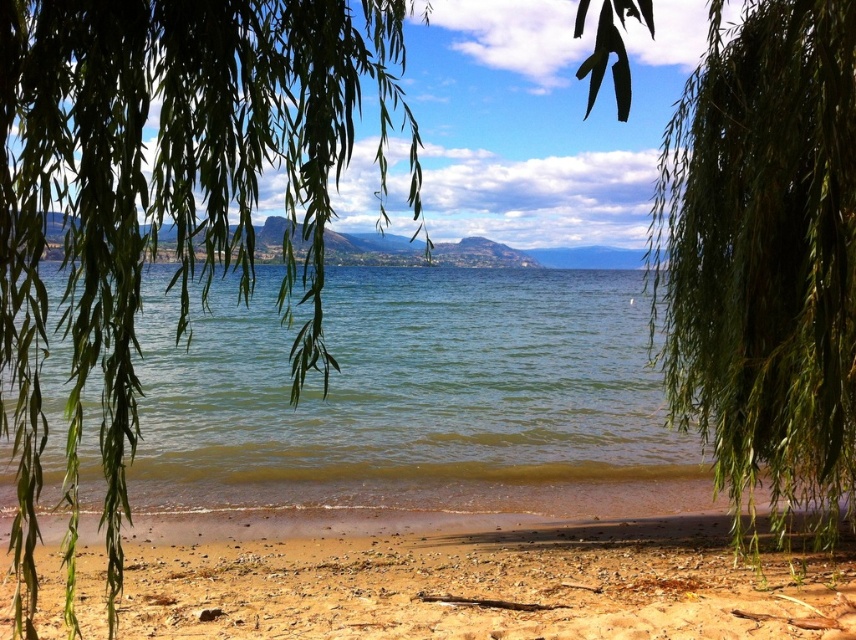
Question: Based on their relative distances, which object is farther from the brown sandy beach at lower center?

Choices:
 (A) green leafy branch at center
 (B) green leafy tree at center

Answer: (B)

Question: Is green leafy tree at center in front of green leafy branch at center?

Choices:
 (A) no
 (B) yes

Answer: (B)

Question: Which object is positioned closest to the green leafy branch at center?

Choices:
 (A) brown sandy beach at lower center
 (B) green leafy tree at center

Answer: (B)

Question: Is green leafy branch at center positioned in front of brown sandy beach at lower center?

Choices:
 (A) no
 (B) yes

Answer: (B)

Question: Does green leafy branch at center appear on the right side of brown sandy beach at lower center?

Choices:
 (A) yes
 (B) no

Answer: (A)

Question: Among these points, which one is nearest to the camera?

Choices:
 (A) 575,636
 (B) 788,211
 (C) 33,97

Answer: (C)